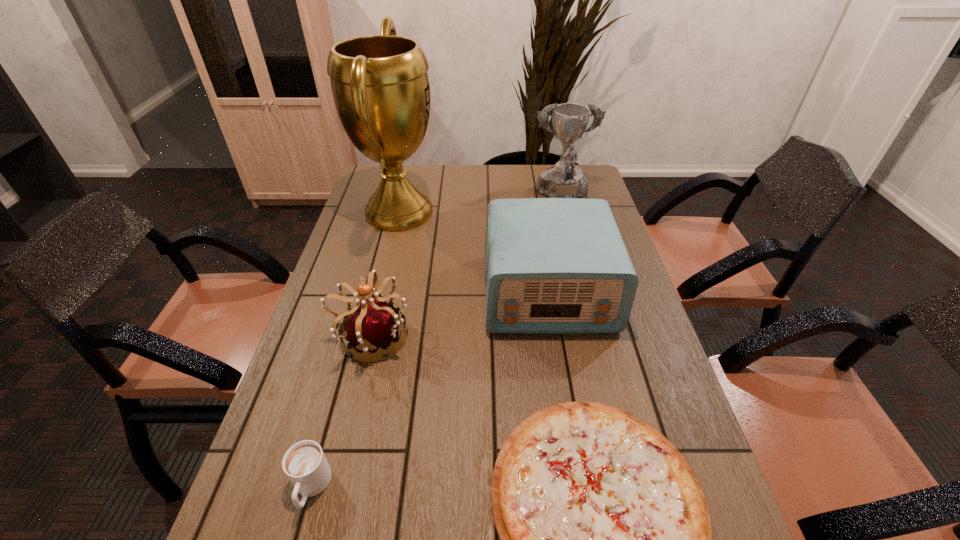
Where is `the tallest object`? The width and height of the screenshot is (960, 540). the tallest object is located at coordinates pyautogui.click(x=380, y=85).

At what (x,y) coordinates should I click in order to perform the action: click on the fifth shortest object. Please return your answer as a coordinate pair (x, y). Looking at the image, I should click on (563, 180).

Locate an element on the screen. The height and width of the screenshot is (540, 960). radio receiver is located at coordinates (552, 265).

Where is `tiara`? tiara is located at coordinates (373, 323).

Find the location of a particular element. the second shortest object is located at coordinates (304, 463).

Identify the location of free space located 0.090m on the surface of the trophy cup with symbols. The image size is (960, 540). (465, 212).

The width and height of the screenshot is (960, 540). Find the location of `vacant point located 0.200m on the side with emblem of the second tallest object`. vacant point located 0.200m on the side with emblem of the second tallest object is located at coordinates (576, 249).

You are a GUI agent. You are given a task and a screenshot of the screen. Output one action in this format:
    pyautogui.click(x=<x>, y=<y>)
    Task: Click on the free spot located 0.190m on the front panel of the radio receiver
    
    Given the screenshot: What is the action you would take?
    pyautogui.click(x=566, y=399)

Identify the location of free region located 0.280m on the front-facing side of the tiara. The image size is (960, 540). (519, 336).

This screenshot has width=960, height=540. I want to click on trophy cup located in the far edge section of the desktop, so click(380, 85).